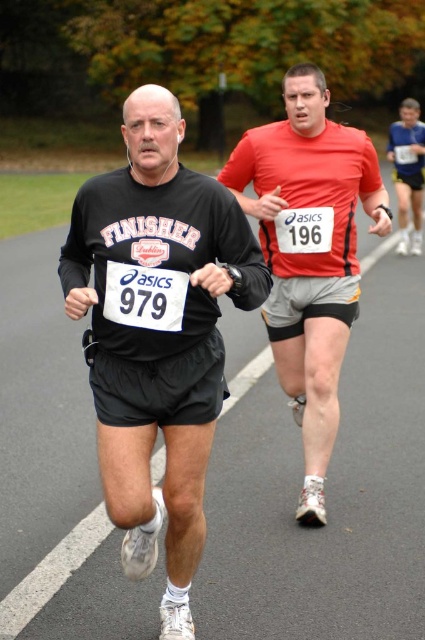
Which of these two, matte red shirt at center or matte red shorts at right, stands shorter?

matte red shirt at center is shorter.

Locate an element on the screen. matte red shirt at center is located at coordinates (308, 253).

Is the position of black matte running shorts at left more distant than that of matte red shorts at right?

No, it is in front of matte red shorts at right.

Measure the distance between point (169,557) and camera.

Point (169,557) is 11.85 feet away from camera.

Locate an element on the screen. This screenshot has width=425, height=640. black matte running shorts at left is located at coordinates (158, 333).

Between black matte running shorts at left and matte red shirt at center, which one appears on the right side from the viewer's perspective?

Positioned to the right is matte red shirt at center.

Does black matte running shorts at left come in front of matte red shirt at center?

Yes, it is in front of matte red shirt at center.

What are the coordinates of `black matte running shorts at left` in the screenshot? It's located at (158, 333).